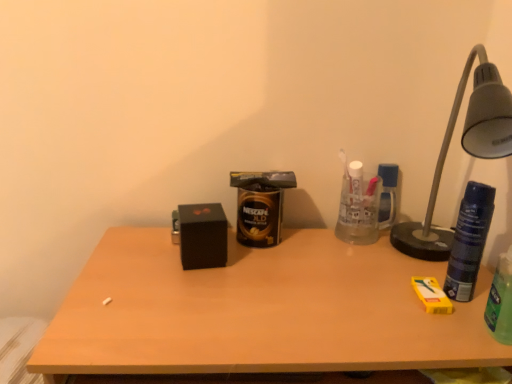
Where is `vacant area to the left of green plastic bottle at right, which appears as the 1th beverage when viewed from the right`? This screenshot has height=384, width=512. vacant area to the left of green plastic bottle at right, which appears as the 1th beverage when viewed from the right is located at coordinates (402, 318).